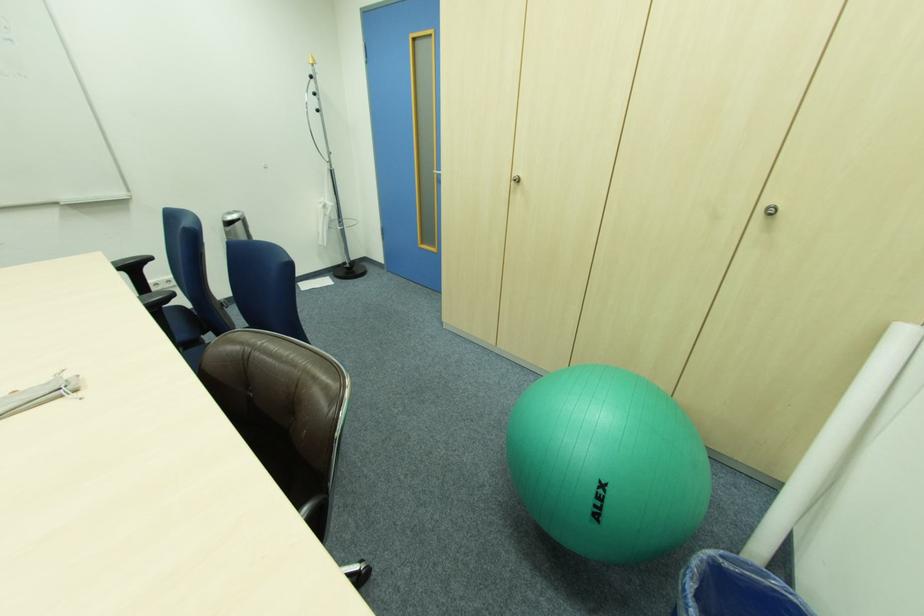
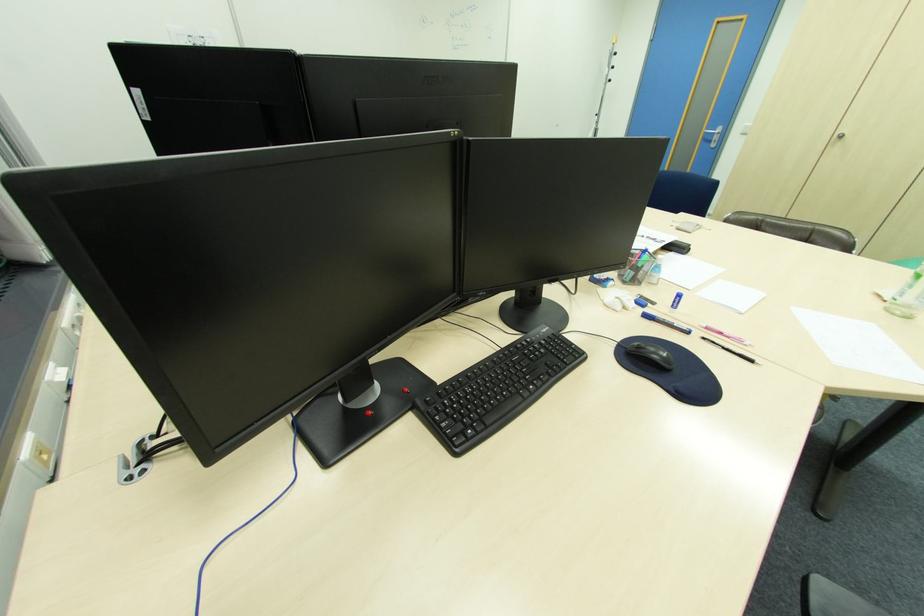
What movement of the cameraman would produce the second image?

The movement direction of the cameraman is left, backward.